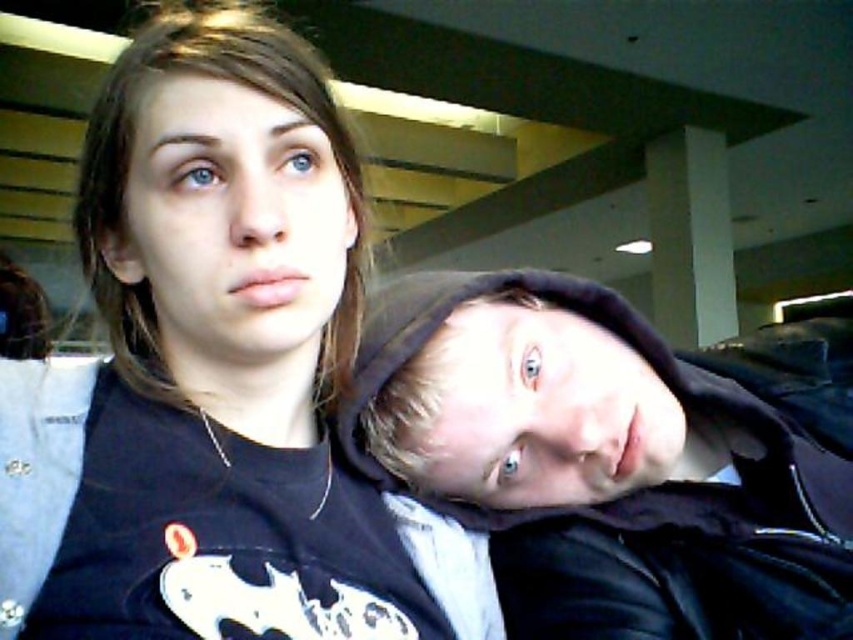
Does black hoodie at upper right appear over black hoodie at center?

Correct, black hoodie at upper right is located above black hoodie at center.

This screenshot has width=853, height=640. Describe the element at coordinates (215, 374) in the screenshot. I see `black hoodie at upper right` at that location.

Between point (109, 237) and point (549, 284), which one is positioned in front?

Point (109, 237) is in front.

You are a GUI agent. You are given a task and a screenshot of the screen. Output one action in this format:
    pyautogui.click(x=<x>, y=<y>)
    Task: Click on the black hoodie at upper right
    The width and height of the screenshot is (853, 640).
    Given the screenshot: What is the action you would take?
    pyautogui.click(x=215, y=374)